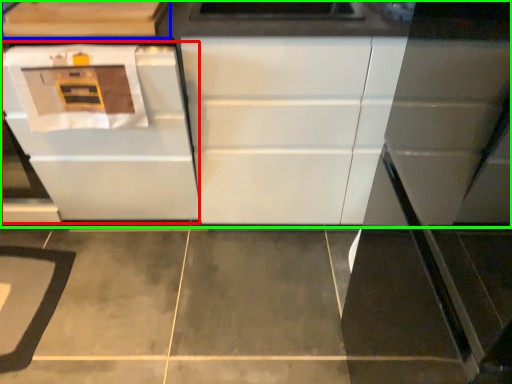
Question: Which object is positioned closest to oven (highlighted by a red box)? Select from cabinetry (highlighted by a blue box) and cabinetry (highlighted by a green box).

Choices:
 (A) cabinetry
 (B) cabinetry

Answer: (B)